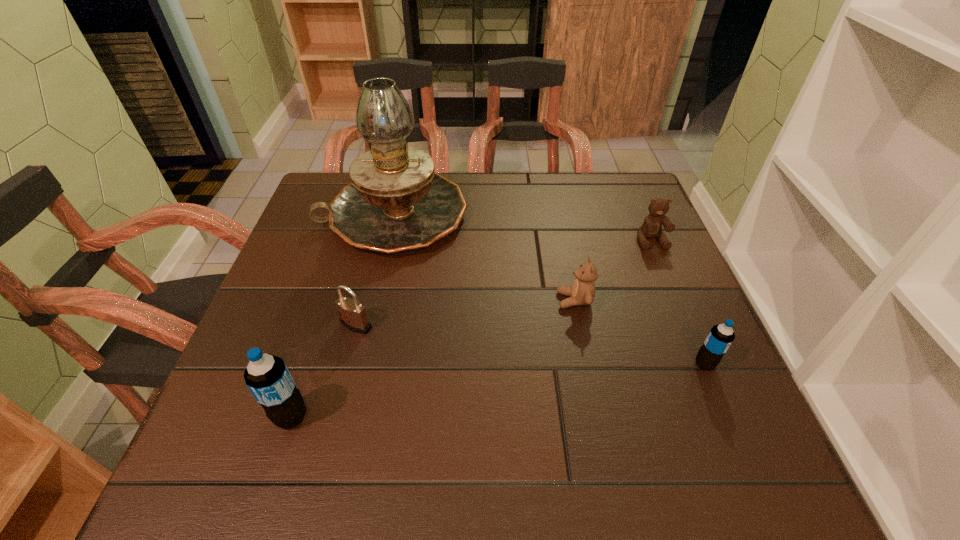
Image resolution: width=960 pixels, height=540 pixels. Identify the location of vacant space that's between the tallest object and the third object from right to left. (484, 258).

You are a GUI agent. You are given a task and a screenshot of the screen. Output one action in this format:
    pyautogui.click(x=<x>, y=<y>)
    Task: Click on the empty space that is in between the shorter soda bottle and the oil lamp
    
    Given the screenshot: What is the action you would take?
    pyautogui.click(x=549, y=289)

The width and height of the screenshot is (960, 540). I want to click on free spot between the nearer teddy bear and the taller soda bottle, so click(x=433, y=359).

Locate an element on the screen. This screenshot has height=540, width=960. free space between the padlock and the oil lamp is located at coordinates (374, 270).

You are a GUI agent. You are given a task and a screenshot of the screen. Output one action in this format:
    pyautogui.click(x=<x>, y=<y>)
    Task: Click on the vacant point located between the farther teddy bear and the left soda bottle
    This screenshot has width=960, height=540.
    Given the screenshot: What is the action you would take?
    pyautogui.click(x=471, y=329)

At what (x,y) coordinates should I click in order to perform the action: click on empty location between the tallest object and the nearer teddy bear. Please return your answer as a coordinate pair (x, y). This screenshot has width=960, height=540. Looking at the image, I should click on (484, 258).

Locate an element on the screen. Image resolution: width=960 pixels, height=540 pixels. unoccupied area between the nearest object and the farther soda bottle is located at coordinates (498, 390).

Locate an element on the screen. The height and width of the screenshot is (540, 960). free point between the nearer teddy bear and the right teddy bear is located at coordinates (612, 271).

Find the location of a particular element. free space between the padlock and the tallest object is located at coordinates (374, 270).

Where is `unoccupied position between the oil lamp and the fourth object from left to right`? unoccupied position between the oil lamp and the fourth object from left to right is located at coordinates click(484, 258).